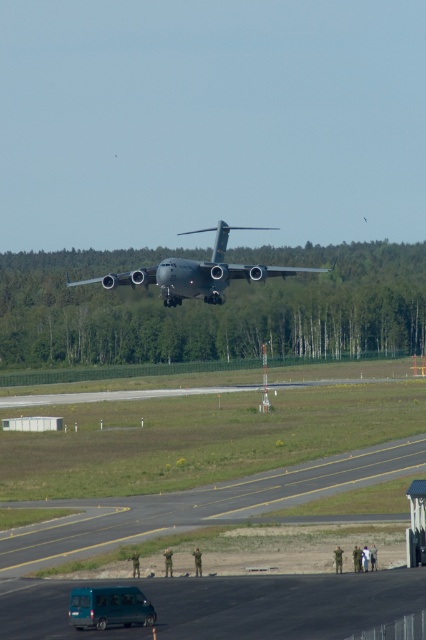
Question: Among these objects, which one is nearest to the camera?

Choices:
 (A) asphalt runway at lower center
 (B) metallic gray aircraft at center
 (C) teal matte van at lower left

Answer: (C)

Question: Observing the image, what is the correct spatial positioning of metallic gray aircraft at center in reference to teal matte van at lower left?

Choices:
 (A) right
 (B) left

Answer: (B)

Question: Which point is closer to the camera?

Choices:
 (A) (118, 589)
 (B) (170, 300)
 (C) (178, 512)

Answer: (A)

Question: Does metallic gray aircraft at center lie in front of teal matte van at lower left?

Choices:
 (A) yes
 (B) no

Answer: (B)

Question: Is asphalt runway at lower center positioned behind metallic gray aircraft at center?

Choices:
 (A) yes
 (B) no

Answer: (B)

Question: Which point is farther from the camera taking this photo?

Choices:
 (A) (83, 605)
 (B) (336, 460)
 (C) (109, 280)

Answer: (C)